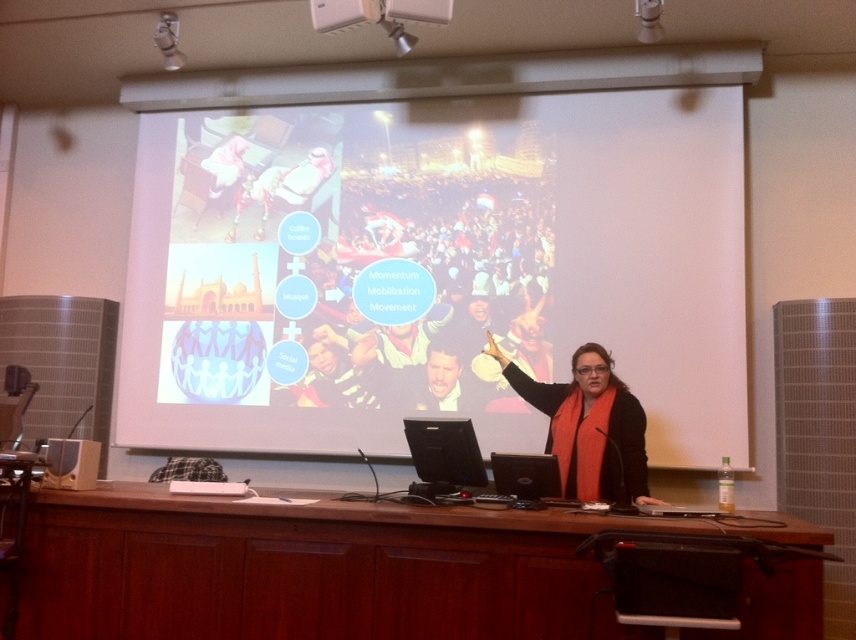
Between point (490, 348) and point (51, 461), which one is positioned in front?

Positioned in front is point (51, 461).

Is black fabric at center positioned before matte black laptop at lower left?

Yes, black fabric at center is in front of matte black laptop at lower left.

Which is behind, point (583, 426) or point (96, 465)?

The point (583, 426) is more distant.

Locate an element on the screen. black fabric at center is located at coordinates (587, 424).

Is white matte projection screen at upper center above black fabric at center?

Yes, white matte projection screen at upper center is above black fabric at center.

Between white matte projection screen at upper center and black fabric at center, which one appears on the right side from the viewer's perspective?

Positioned to the right is black fabric at center.

The image size is (856, 640). Describe the element at coordinates (438, 268) in the screenshot. I see `white matte projection screen at upper center` at that location.

The height and width of the screenshot is (640, 856). Identify the location of white matte projection screen at upper center. (438, 268).

Can you confirm if brown wood table at center is wider than matte black laptop at lower left?

Yes, brown wood table at center is wider than matte black laptop at lower left.

Is brown wood table at center bigger than matte black laptop at lower left?

Indeed, brown wood table at center has a larger size compared to matte black laptop at lower left.

Is point (116, 573) farther from camera compared to point (96, 474)?

No.

You are a GUI agent. You are given a task and a screenshot of the screen. Output one action in this format:
    pyautogui.click(x=<x>, y=<y>)
    Task: Click on the brown wood table at center
    The height and width of the screenshot is (640, 856).
    Given the screenshot: What is the action you would take?
    pyautogui.click(x=310, y=570)